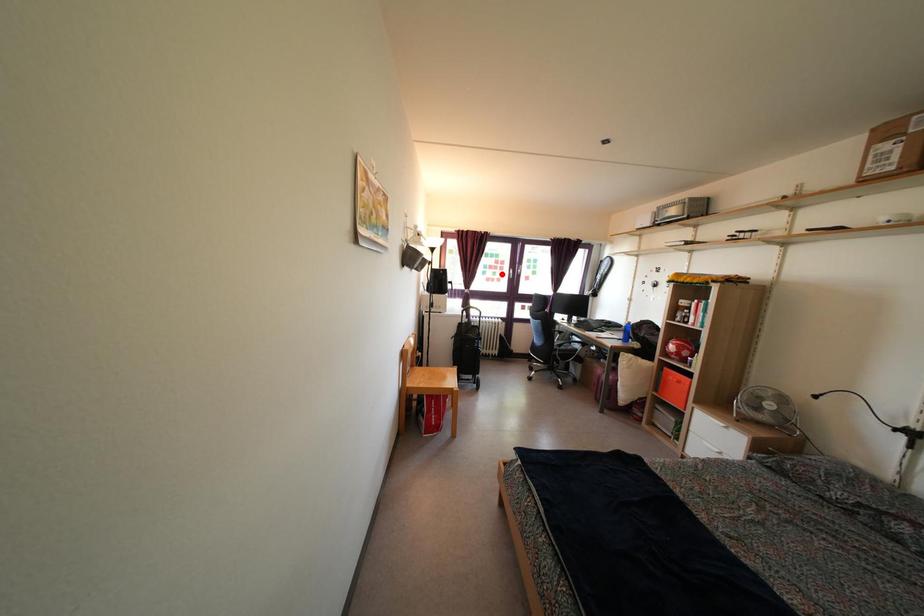
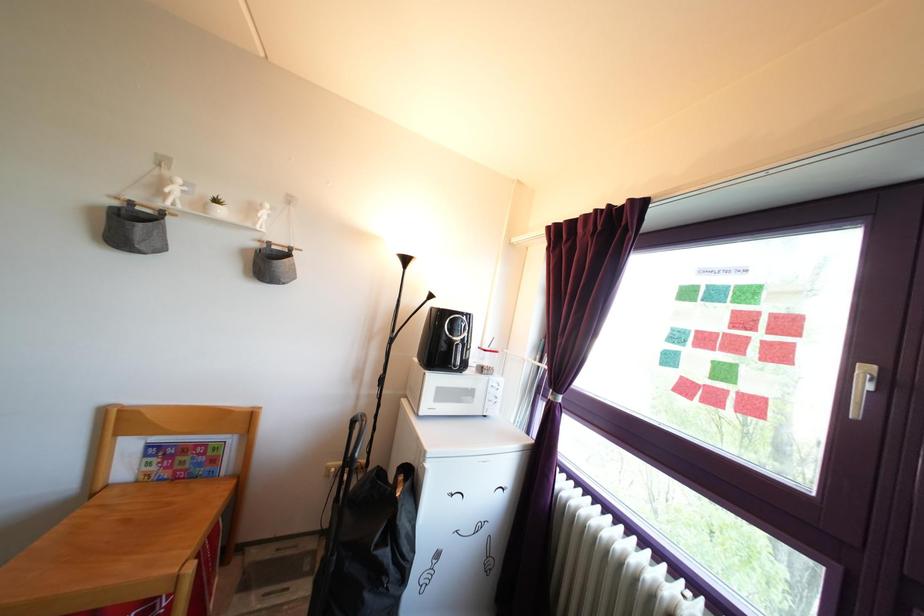
Where in the second image is the point corresponding to the highlighted location from the first image?

(761, 345)